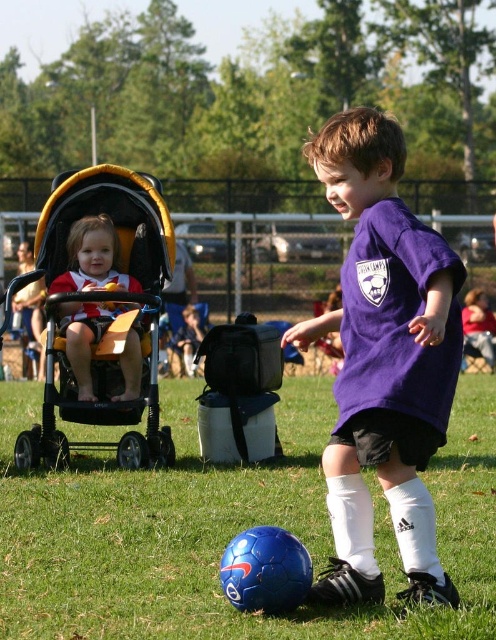
Between green grass at lower center and yellow fabric stroller at left, which one has more height?

yellow fabric stroller at left

Is green grass at lower center to the left of yellow fabric stroller at left from the viewer's perspective?

No, green grass at lower center is not to the left of yellow fabric stroller at left.

Is point (111, 474) closer to camera compared to point (167, 227)?

Yes, it is.

You are a GUI agent. You are given a task and a screenshot of the screen. Output one action in this format:
    pyautogui.click(x=<x>, y=<y>)
    Task: Click on the green grass at lower center
    
    Given the screenshot: What is the action you would take?
    pyautogui.click(x=227, y=529)

Does point (347, 378) come behind point (79, 221)?

No, it is in front of (79, 221).

Can you confirm if purple matte shirt at center is thinner than matte red and white shirt at left?

Incorrect, purple matte shirt at center's width is not less than matte red and white shirt at left's.

Is point (365, 458) more distant than point (123, 275)?

No, (365, 458) is closer to viewer.

Locate an element on the screen. purple matte shirt at center is located at coordinates (383, 360).

Is green grass at lower center thinner than purple matte shirt at center?

Correct, green grass at lower center's width is less than purple matte shirt at center's.

What do you see at coordinates (227, 529) in the screenshot? The width and height of the screenshot is (496, 640). I see `green grass at lower center` at bounding box center [227, 529].

The width and height of the screenshot is (496, 640). Describe the element at coordinates (227, 529) in the screenshot. I see `green grass at lower center` at that location.

Find the location of a particular element. The height and width of the screenshot is (640, 496). green grass at lower center is located at coordinates (227, 529).